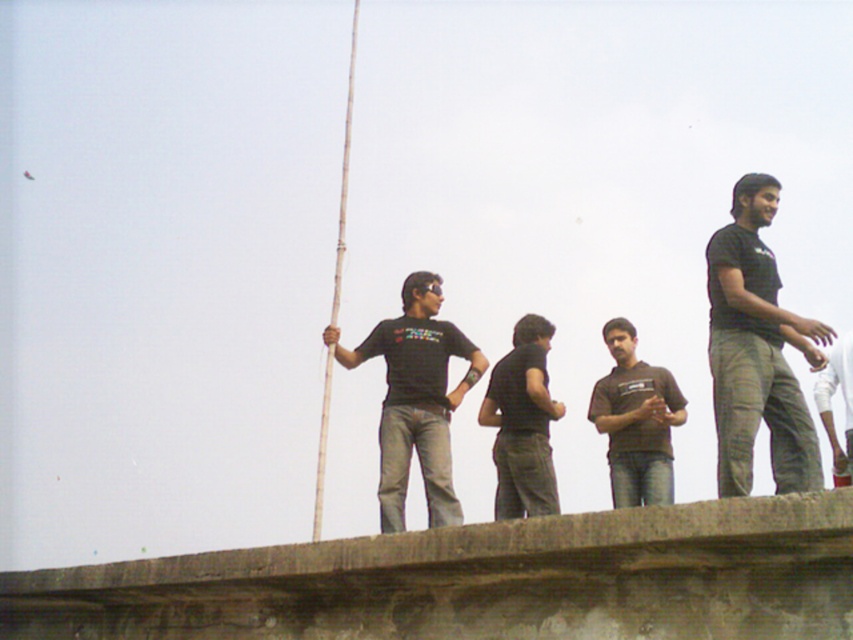
Question: Which point is farther to the camera?

Choices:
 (A) black matte shirt at center
 (B) smooth bamboo pole at center
 (C) brown matte shirt at center
 (D) matte black t-shirt at center

Answer: (A)

Question: In this image, where is smooth bamboo pole at center located relative to white cotton pants at right?

Choices:
 (A) left
 (B) right

Answer: (A)

Question: Which point is farther to the camera?

Choices:
 (A) (398, 422)
 (B) (664, 385)
 (C) (541, 353)

Answer: (C)

Question: Which point is closer to the camera?

Choices:
 (A) black matte shirt at center
 (B) matte black t-shirt at center
 (C) white cotton pants at right
 (D) brown matte shirt at center

Answer: (B)

Question: Does matte black t-shirt at center appear over white cotton pants at right?

Choices:
 (A) no
 (B) yes

Answer: (A)

Question: Can you confirm if matte black t-shirt at center is thinner than white cotton pants at right?

Choices:
 (A) no
 (B) yes

Answer: (A)